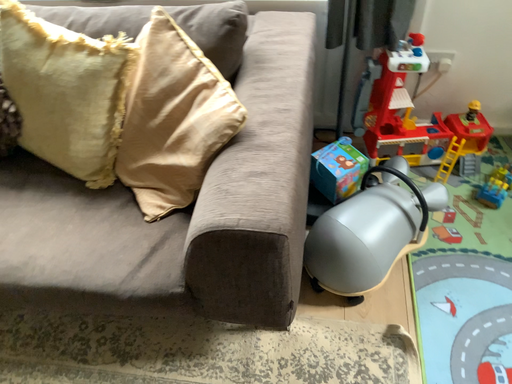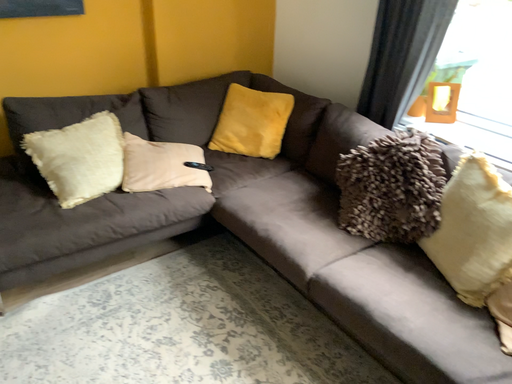
Question: Which way did the camera rotate in the video?

Choices:
 (A) rotated upward
 (B) rotated downward

Answer: (A)